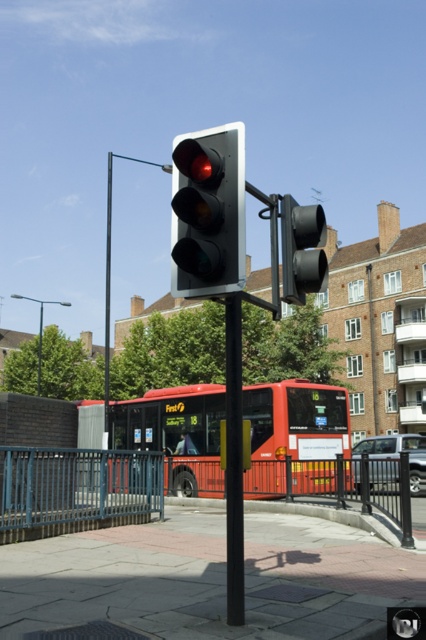
Does metallic blue bus stop at lower left have a larger size compared to matte black traffic light at center?

Incorrect, metallic blue bus stop at lower left is not larger than matte black traffic light at center.

Can you confirm if metallic blue bus stop at lower left is positioned below matte black traffic light at center?

Indeed, metallic blue bus stop at lower left is positioned under matte black traffic light at center.

Which is behind, point (45, 480) or point (219, 144)?

Point (45, 480)

Where is `metallic blue bus stop at lower left`? metallic blue bus stop at lower left is located at coordinates (75, 490).

Does matte black traffic light at center have a lesser width compared to black matte pole at center?

Incorrect, matte black traffic light at center's width is not less than black matte pole at center's.

Who is shorter, matte black traffic light at center or black matte pole at center?

black matte pole at center

Locate an element on the screen. matte black traffic light at center is located at coordinates (209, 211).

Find the location of a particular element. The image size is (426, 640). matte black traffic light at center is located at coordinates (209, 211).

Which is in front, point (261, 422) or point (287, 225)?

Point (287, 225) is more forward.

Is red matte bus at center to the right of black matte traffic light at center from the viewer's perspective?

In fact, red matte bus at center is to the left of black matte traffic light at center.

Is point (157, 445) closer to camera compared to point (287, 268)?

No, (157, 445) is behind (287, 268).

This screenshot has height=640, width=426. In order to click on red matte bus at center in this screenshot , I will do [296, 435].